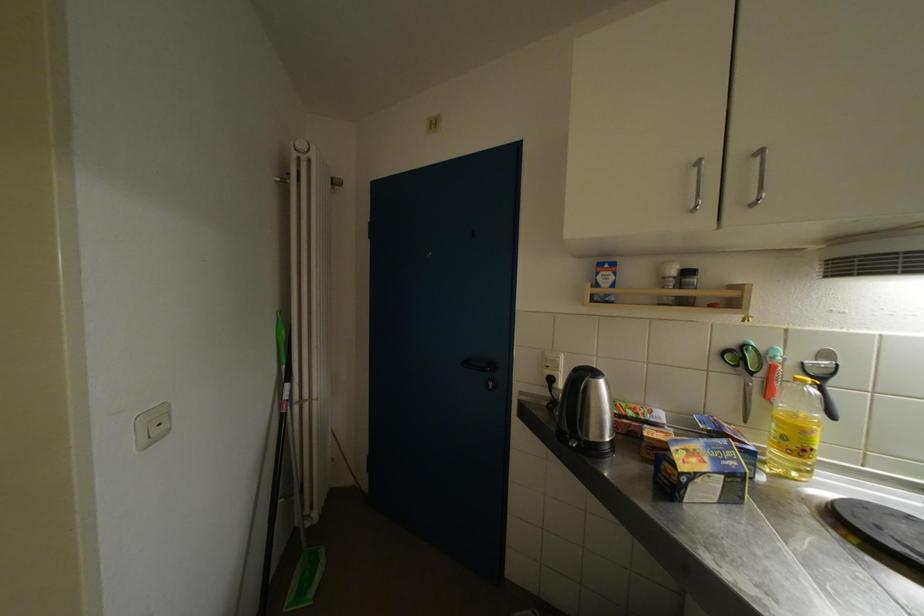
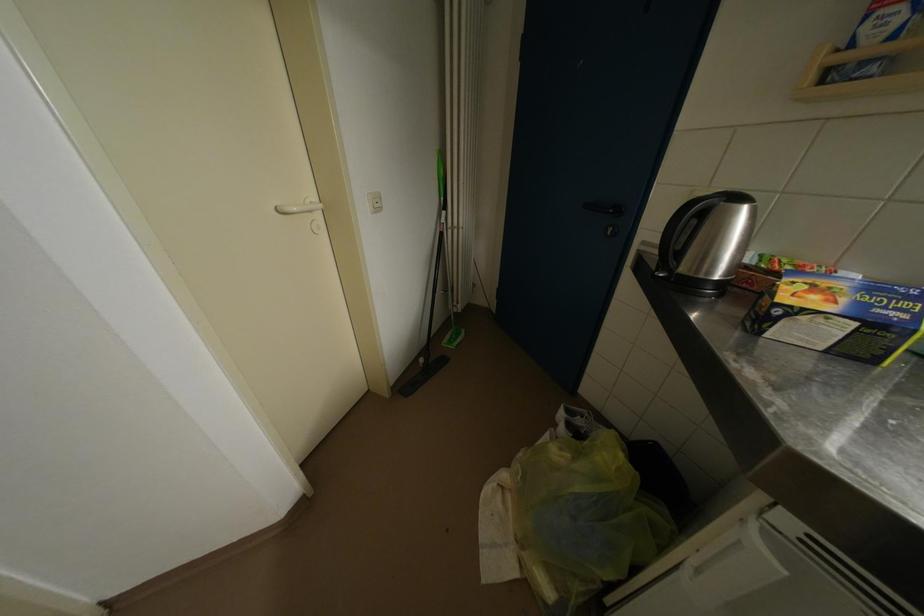
In the second image, find the point that corresponds to the point at 688,471 in the first image.

(791, 302)